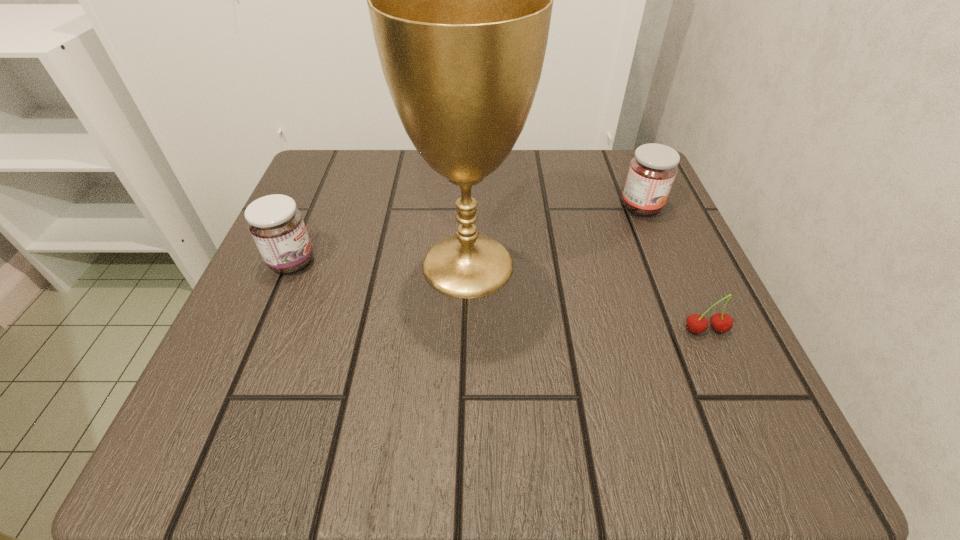
Find the location of a particular element. vacant space located 0.070m on the front label of the left jam is located at coordinates (356, 262).

Where is `free spot located on the surface of the cherry`? The height and width of the screenshot is (540, 960). free spot located on the surface of the cherry is located at coordinates pos(759,454).

Identify the location of object that is at the far edge. The image size is (960, 540). (652, 171).

Where is `object present at the left edge`? This screenshot has height=540, width=960. object present at the left edge is located at coordinates (276, 224).

Where is `jam present at the right edge`? jam present at the right edge is located at coordinates (652, 171).

Find the location of a particular element. cherry that is at the right edge is located at coordinates (720, 322).

Find the location of a particular element. The height and width of the screenshot is (540, 960). object present at the far right corner is located at coordinates (652, 171).

Identify the location of vacant space at the far edge of the desktop. (429, 173).

The width and height of the screenshot is (960, 540). Find the location of `vacant space at the near edge of the desktop`. vacant space at the near edge of the desktop is located at coordinates (558, 456).

In the image, there is a desktop. At what (x,y) coordinates should I click in order to perform the action: click on vacant space at the left edge. Please return your answer as a coordinate pair (x, y). This screenshot has width=960, height=540. Looking at the image, I should click on pyautogui.click(x=229, y=387).